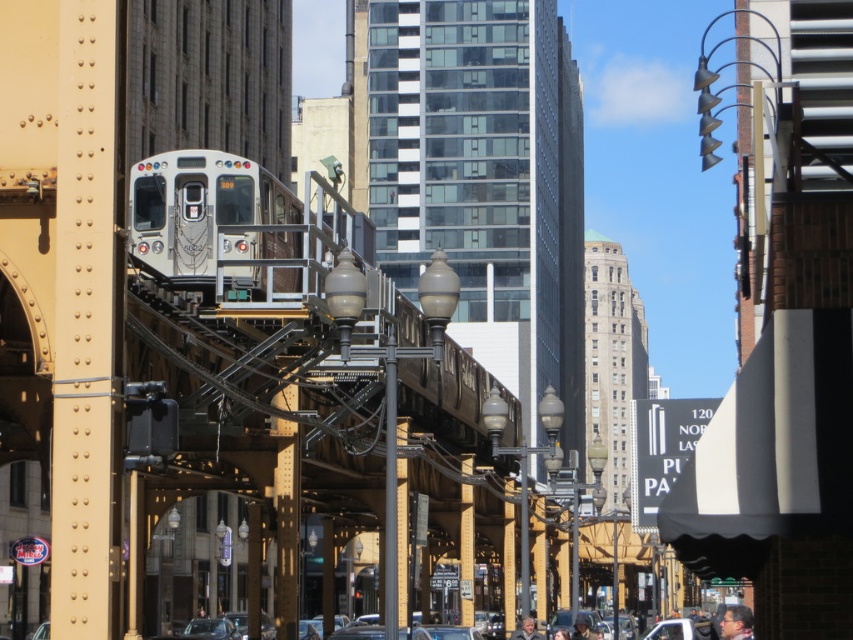
Consider the image. You are a delivery person needing to pass through the space between the silver metallic train at center and the metallic silver car at lower center with your 2.5 meter wide truck. Can your truck fit through the gap?

The silver metallic train at center might be wider than the metallic silver car at lower center, but without knowing the exact width of the gap, it is uncertain if the 2.5 meter wide truck can fit through. Please check the actual space before proceeding.

You are a pedestrian standing at the intersection and see a silver metallic train at center and a metallic silver car at lower center. Which one is higher from the ground?

The silver metallic train at center is located above the metallic silver car at lower center, so it is higher from the ground.

You are a city planner analyzing the image to determine the best location for a new pedestrian walkway. Given the presence of the silver metallic train at center and the metallic silver car at lower center, which object is closer to the foreground to ensure safety for pedestrians?

The metallic silver car at lower center is closer to the foreground than the silver metallic train at center, so the walkway should prioritize avoiding the path of the metallic silver car at lower center for pedestrian safety.